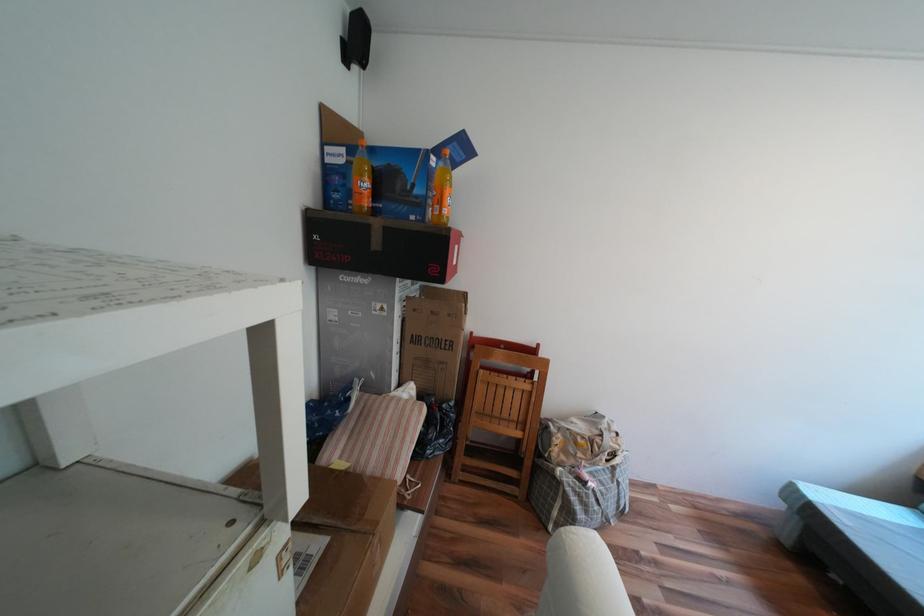
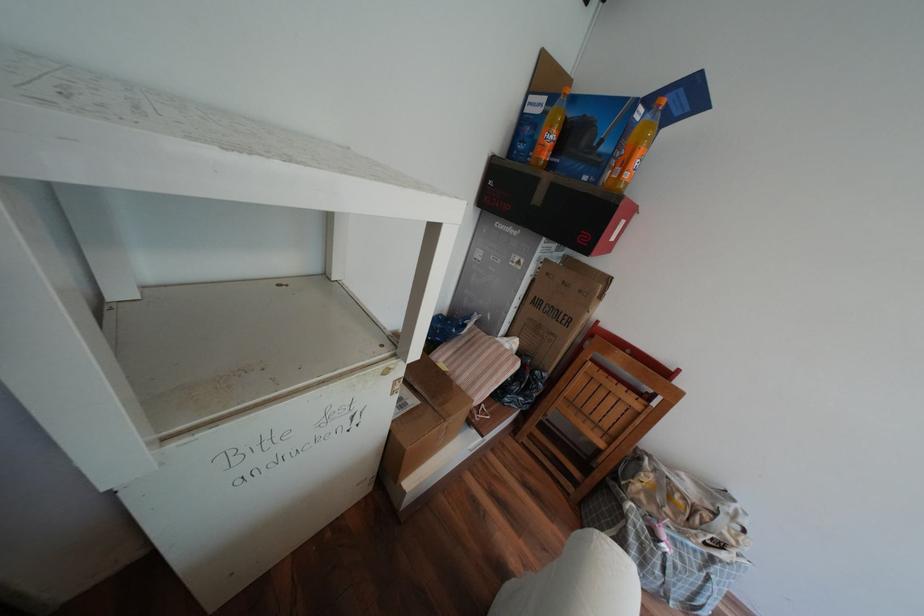
Find the pixel in the second image that matches pixel 458 315 in the first image.

(590, 291)